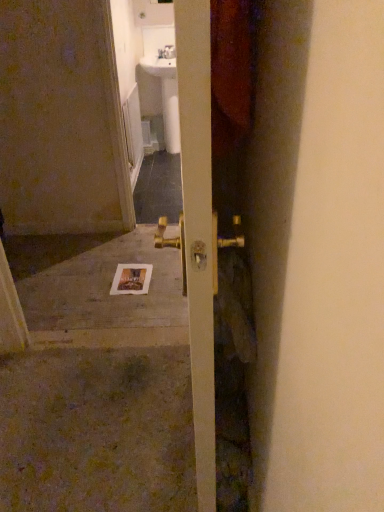
In order to click on vacant area that is situated to the right of white paper postcard at center in this screenshot , I will do `click(165, 279)`.